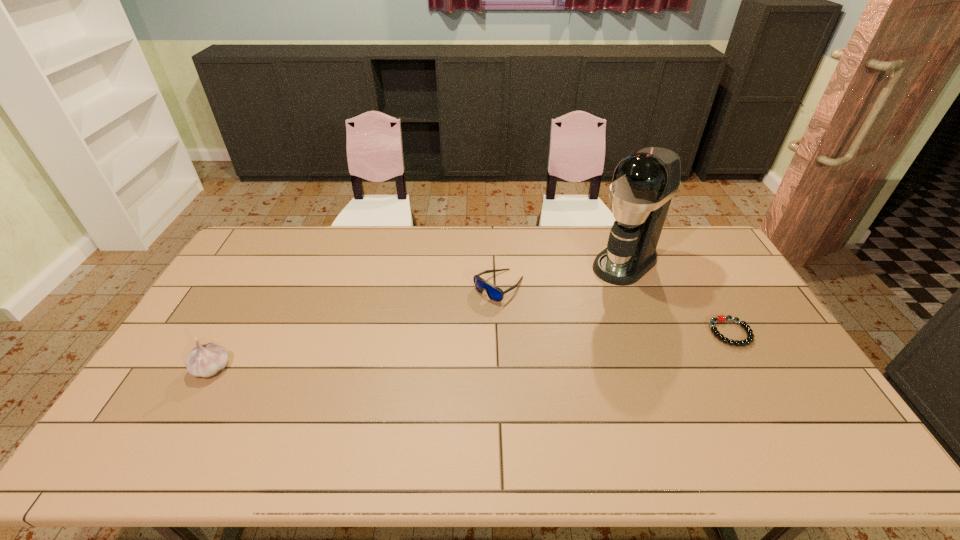
In order to click on vacant spot on the desktop that is between the nearest object and the rightmost object and is positioned place cup under the spout of the coffee maker in this screenshot , I will do `click(525, 347)`.

Image resolution: width=960 pixels, height=540 pixels. In order to click on vacant spot on the desktop that is between the leftmost object and the bracelet and is positioned on the front-facing side of the third object from right to left in this screenshot , I will do `click(410, 354)`.